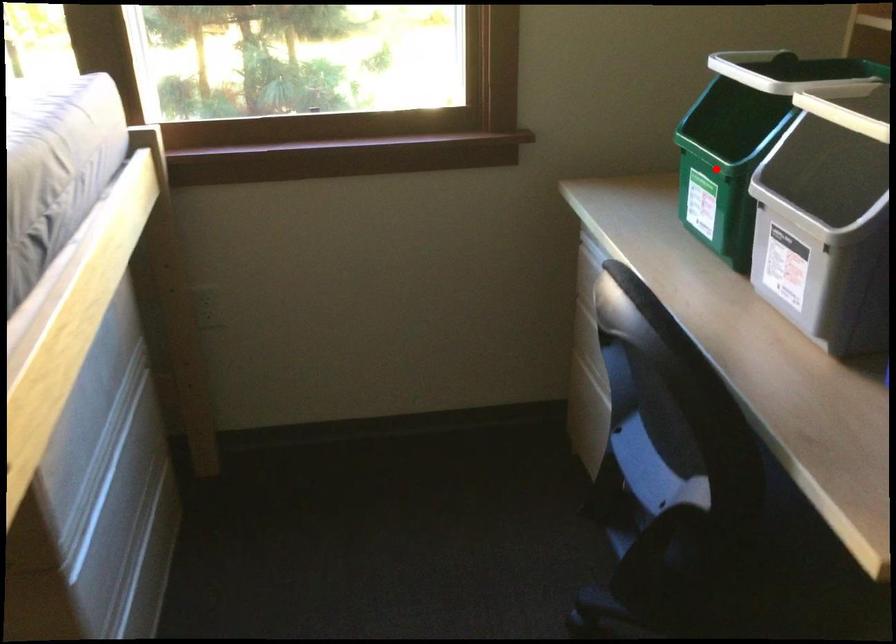
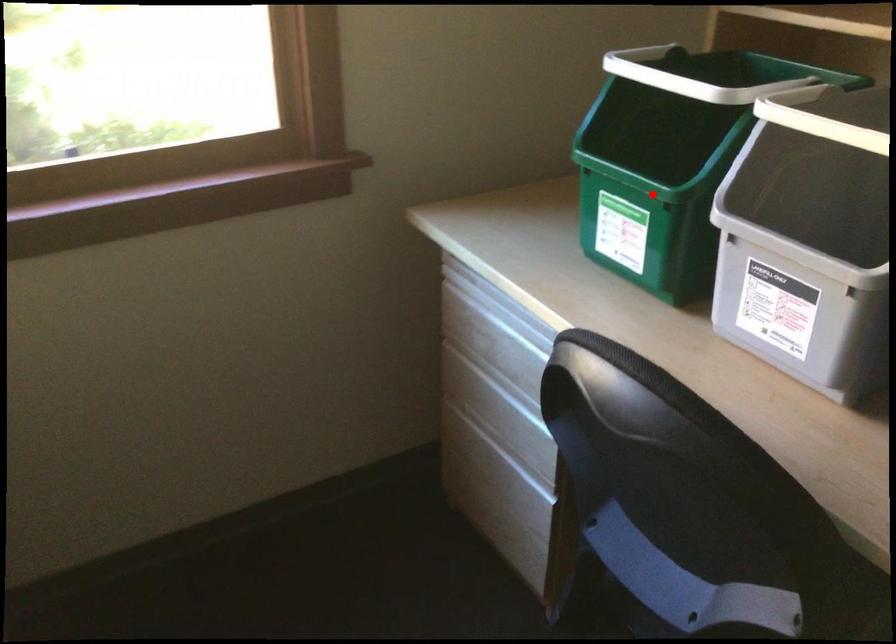
I am providing you with two images of the same scene from different viewpoints. A red point is marked on the first image and another point is marked on the second image. Is the marked point in image1 the same physical position as the marked point in image2?

Yes